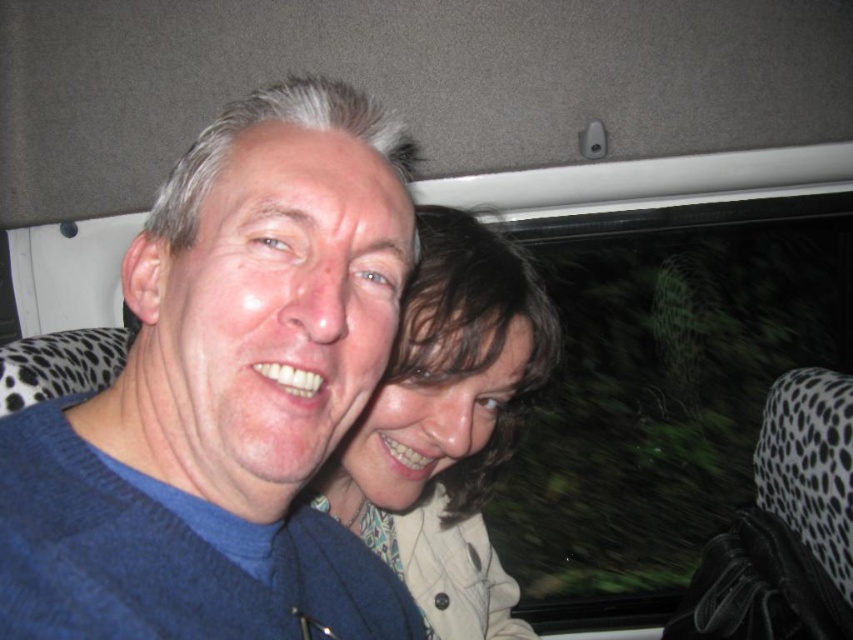
Question: Which of the following is the closest to the observer?

Choices:
 (A) (264, 424)
 (B) (433, 486)

Answer: (A)

Question: Is blue knitted sweater at center positioned at the back of light brown textured hair at center?

Choices:
 (A) no
 (B) yes

Answer: (A)

Question: Observing the image, what is the correct spatial positioning of blue knitted sweater at center in reference to black dotted fabric at right?

Choices:
 (A) right
 (B) left

Answer: (B)

Question: Which of these objects is positioned closest to the light brown textured hair at center?

Choices:
 (A) blue knitted sweater at center
 (B) black dotted fabric at right

Answer: (A)

Question: Considering the real-world distances, which object is closest to the black dotted fabric at right?

Choices:
 (A) blue knitted sweater at center
 (B) light brown textured hair at center

Answer: (B)

Question: Does blue knitted sweater at center appear under black dotted fabric at right?

Choices:
 (A) yes
 (B) no

Answer: (B)